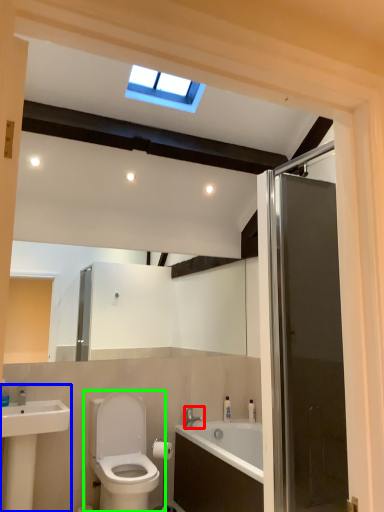
Question: Which is nearer to the tap (highlighted by a red box)? sink (highlighted by a blue box) or toilet (highlighted by a green box).

Choices:
 (A) sink
 (B) toilet

Answer: (B)